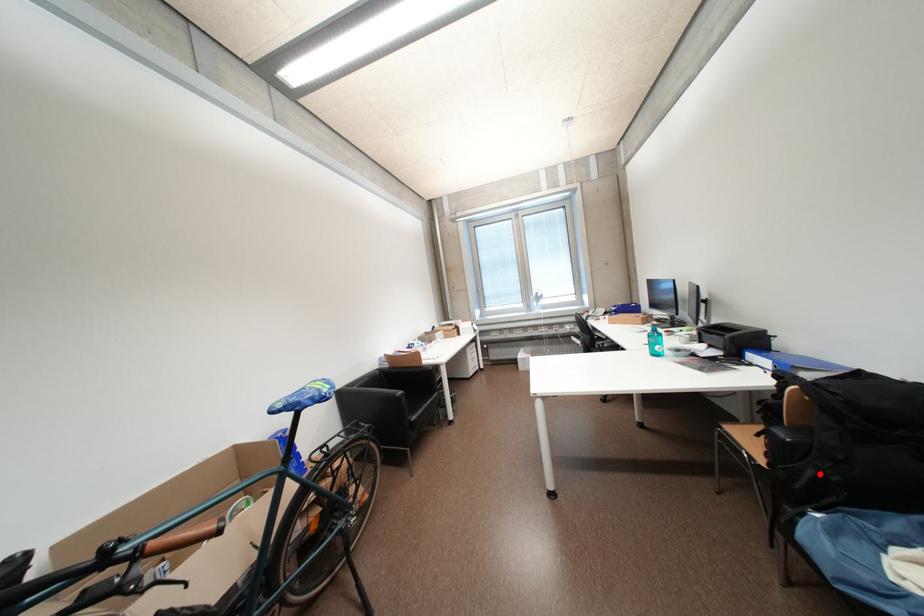
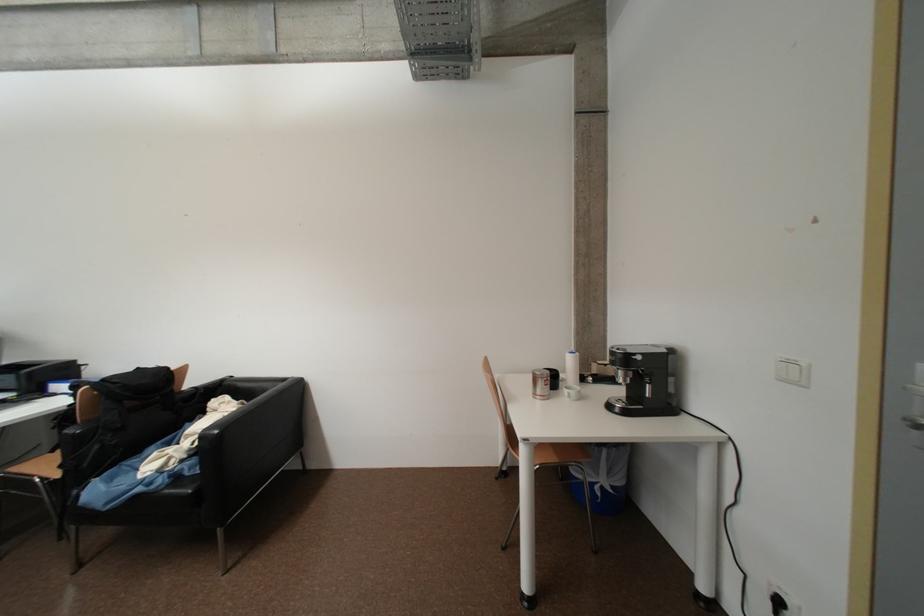
Find the pixel in the second image that matches the highlighted location in the first image.

(104, 448)